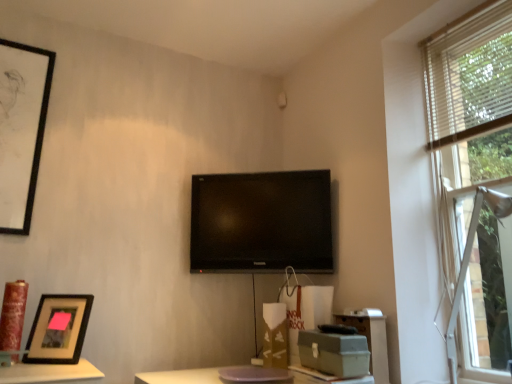
Question: Considering the positions of brown cardboard box at center, positioned as the 1th cardboard box in back-to-front order, and white wood blinds at upper right in the image, is brown cardboard box at center, positioned as the 1th cardboard box in back-to-front order, bigger or smaller than white wood blinds at upper right?

Choices:
 (A) small
 (B) big

Answer: (A)

Question: In the image, is brown cardboard box at center, which is counted as the 2th cardboard box, starting from the front, positioned in front of or behind white wood blinds at upper right?

Choices:
 (A) behind
 (B) front

Answer: (A)

Question: Which object is the closest to the matte gray file cabinet at lower right?

Choices:
 (A) matte gray cardboard box at lower right, marked as the first cardboard box in a right-to-left arrangement
 (B) white plastic window at right
 (C) black glossy tv at center
 (D) white wood blinds at upper right
 (E) black matte picture frame at lower left, the first picture frame when ordered from front to back

Answer: (A)

Question: Which is farther from the black matte picture frame at lower left, the first picture frame when ordered from front to back?

Choices:
 (A) white wood blinds at upper right
 (B) white plastic window at right
 (C) brown cardboard box at center, arranged as the 1th cardboard box when viewed from the left
 (D) wooden frame at right
 (E) black glossy tv at center

Answer: (A)